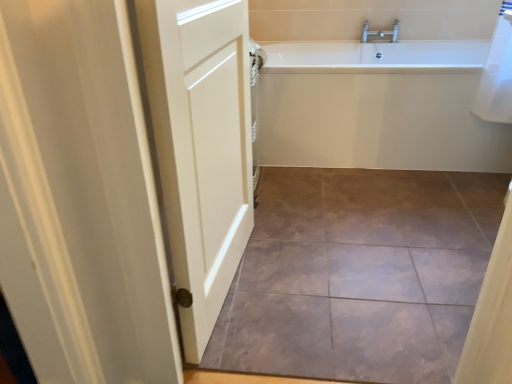
In order to face white glossy bathtub at upper right, should I rotate leftwards or rightwards?

A 16.296 degree turn to the right will do.

Based on the photo, what is the approximate height of white glossy bathtub at upper right?

21.64 inches.

What do you see at coordinates (359, 274) in the screenshot?
I see `brown textured tile at center` at bounding box center [359, 274].

Locate an element on the screen. The width and height of the screenshot is (512, 384). white glossy bathtub at upper right is located at coordinates (377, 107).

Who is shorter, white matte door at left or brown textured tile at center?

brown textured tile at center is shorter.

From a real-world perspective, is white matte door at left positioned under brown textured tile at center based on gravity?

No, from a real-world perspective, white matte door at left is not below brown textured tile at center.

From the picture: How far apart are white matte door at left and brown textured tile at center?

white matte door at left and brown textured tile at center are 19.81 inches apart from each other.

Does white matte door at left turn towards brown textured tile at center?

Yes, white matte door at left is facing brown textured tile at center.

Who is bigger, white glossy bathtub at upper right or brown textured tile at center?

Bigger between the two is white glossy bathtub at upper right.

Does white glossy bathtub at upper right have a greater height compared to brown textured tile at center?

Yes, white glossy bathtub at upper right is taller than brown textured tile at center.

Could you tell me if white glossy bathtub at upper right is turned towards brown textured tile at center?

Yes, white glossy bathtub at upper right is aimed at brown textured tile at center.

Is brown textured tile at center placed right next to white matte door at left?

brown textured tile at center and white matte door at left are not in contact.

Which is in front, brown textured tile at center or white matte door at left?

white matte door at left is in front.

From a real-world perspective, is brown textured tile at center positioned above or below white matte door at left?

brown textured tile at center is situated lower than white matte door at left in the real world.

Which of these two, brown textured tile at center or white matte door at left, is wider?

brown textured tile at center is wider.

From the image's perspective, does white matte door at left appear lower than white glossy bathtub at upper right?

Correct, white matte door at left appears lower than white glossy bathtub at upper right in the image.

The image size is (512, 384). What are the coordinates of `bathtub behind the white matte door at left` in the screenshot? It's located at (377, 107).

Could white glossy bathtub at upper right be considered to be inside white matte door at left?

No, white glossy bathtub at upper right is located outside of white matte door at left.

Considering the sizes of objects white matte door at left and white glossy bathtub at upper right in the image provided, who is smaller, white matte door at left or white glossy bathtub at upper right?

Smaller between the two is white matte door at left.

This screenshot has height=384, width=512. Identify the location of bathtub below the white matte door at left (from a real-world perspective). (377, 107).

In the image, is white glossy bathtub at upper right positioned in front of or behind white matte door at left?

Visually, white glossy bathtub at upper right is located behind white matte door at left.

From the image's perspective, between white glossy bathtub at upper right and white matte door at left, which one is located above?

white glossy bathtub at upper right is shown above in the image.

Which is more to the left, brown textured tile at center or white glossy bathtub at upper right?

brown textured tile at center.

From a real-world perspective, which object rests below the other?

brown textured tile at center.

Does point (297, 208) appear closer or farther from the camera than point (386, 129)?

Point (297, 208).

Would you say brown textured tile at center is outside white glossy bathtub at upper right?

Indeed, brown textured tile at center is completely outside white glossy bathtub at upper right.

Find the location of a particular element. door on the left of brown textured tile at center is located at coordinates (200, 146).

Identify the location of bathtub above the brown textured tile at center (from a real-world perspective). (377, 107).

When comparing their distances from white glossy bathtub at upper right, does white matte door at left or brown textured tile at center seem closer?

brown textured tile at center lies closer to white glossy bathtub at upper right than the other object.

From the image, which object appears to be farther from white matte door at left, white glossy bathtub at upper right or brown textured tile at center?

white glossy bathtub at upper right is further to white matte door at left.

Which object lies nearer to the anchor point white glossy bathtub at upper right, brown textured tile at center or white matte door at left?

Based on the image, brown textured tile at center appears to be nearer to white glossy bathtub at upper right.

When comparing their distances from white matte door at left, does brown textured tile at center or white glossy bathtub at upper right seem further?

white glossy bathtub at upper right.

From the picture: From the image, which object appears to be nearer to brown textured tile at center, white matte door at left or white glossy bathtub at upper right?

The object closer to brown textured tile at center is white matte door at left.

From the image, which object appears to be farther from brown textured tile at center, white glossy bathtub at upper right or white matte door at left?

white glossy bathtub at upper right is further to brown textured tile at center.

The image size is (512, 384). What are the coordinates of `ceramic tile positioned between white matte door at left and white glossy bathtub at upper right from near to far` in the screenshot? It's located at (359, 274).